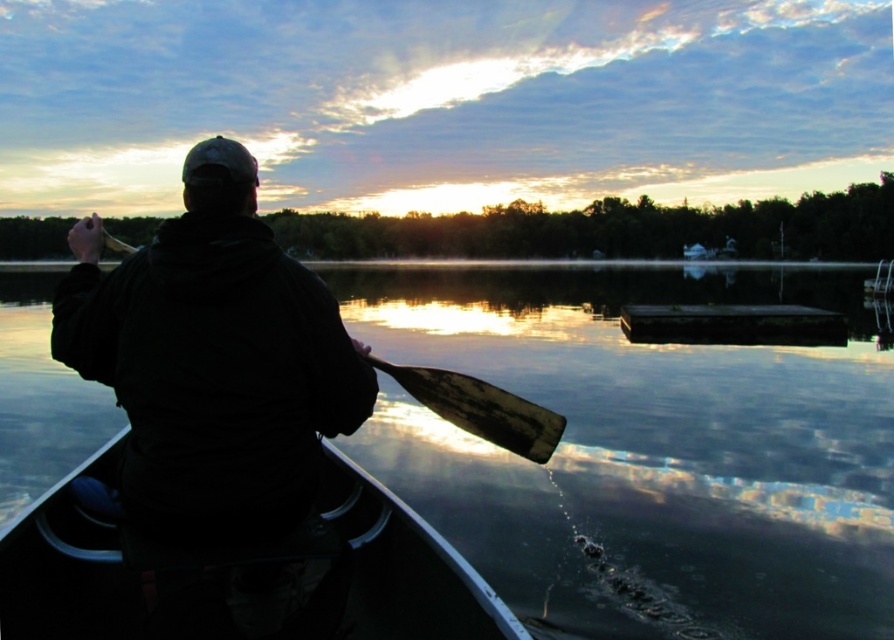
Question: Which of the following is the closest to the observer?

Choices:
 (A) (395, 444)
 (B) (482, 412)
 (C) (546, 445)

Answer: (B)

Question: Can you confirm if wooden at left is bigger than wooden paddle at center?

Choices:
 (A) no
 (B) yes

Answer: (A)

Question: Can you confirm if smooth water at center is bigger than black plastic canoe at lower left?

Choices:
 (A) yes
 (B) no

Answer: (A)

Question: Which object is farther from the camera taking this photo?

Choices:
 (A) wooden at left
 (B) smooth water at center
 (C) black plastic canoe at lower left
 (D) wooden paddle at center

Answer: (B)

Question: Which point is farther from the camera taking this photo?

Choices:
 (A) (513, 413)
 (B) (429, 396)
 (C) (690, 400)
 (D) (108, 476)

Answer: (C)

Question: Does black plastic canoe at lower left have a larger size compared to wooden at left?

Choices:
 (A) yes
 (B) no

Answer: (A)